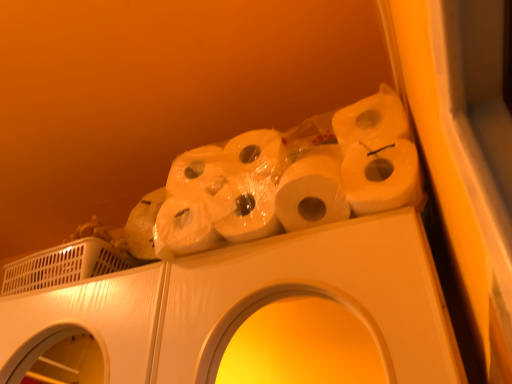
Question: Is white plastic washing machine at upper left inside the boundaries of white matte toilet paper at upper center, or outside?

Choices:
 (A) inside
 (B) outside

Answer: (B)

Question: Is white plastic washing machine at upper left taller or shorter than white matte toilet paper at upper center?

Choices:
 (A) short
 (B) tall

Answer: (A)

Question: In the image, is white plastic washing machine at upper left on the left side or the right side of white matte toilet paper at upper center?

Choices:
 (A) left
 (B) right

Answer: (A)

Question: From the image's perspective, relative to white plastic washing machine at upper left, is white matte toilet paper at upper center above or below?

Choices:
 (A) above
 (B) below

Answer: (A)

Question: In terms of width, does white matte toilet paper at upper center look wider or thinner when compared to white plastic washing machine at upper left?

Choices:
 (A) wide
 (B) thin

Answer: (B)

Question: Is point (395, 193) closer or farther from the camera than point (95, 369)?

Choices:
 (A) farther
 (B) closer

Answer: (B)

Question: Would you say white matte toilet paper at upper center is inside or outside white plastic washing machine at upper left?

Choices:
 (A) outside
 (B) inside

Answer: (A)